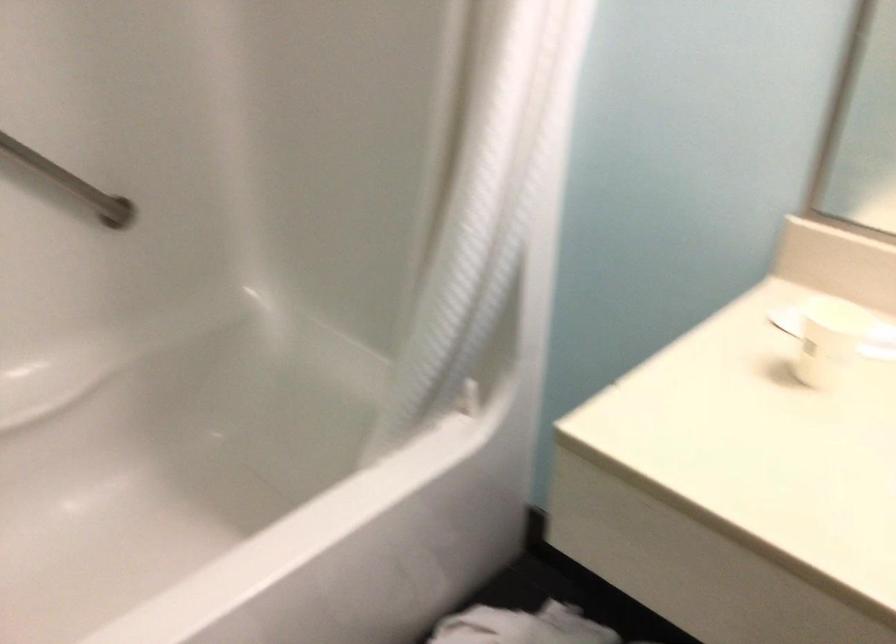
This screenshot has height=644, width=896. Find the location of `metal grab bar`. metal grab bar is located at coordinates (65, 178).